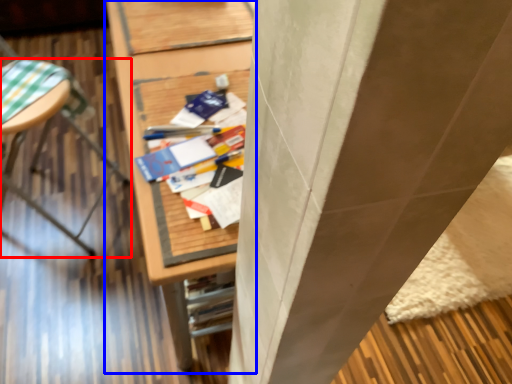
Question: Among these objects, which one is farthest to the camera, furniture (highlighted by a red box) or furniture (highlighted by a blue box)?

Choices:
 (A) furniture
 (B) furniture

Answer: (A)